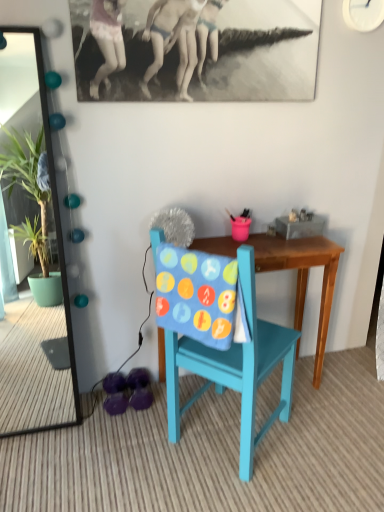
What do you see at coordinates (140, 388) in the screenshot? This screenshot has height=512, width=384. I see `purple fabric footwear at lower left` at bounding box center [140, 388].

In order to face teal painted wood chair at center, should I rotate leftwards or rightwards?

Rotate right and turn 5.147 degrees.

Where is `wooden table at center`? The height and width of the screenshot is (512, 384). wooden table at center is located at coordinates [x=302, y=276].

Locate an element on the screen. green glossy mirror at left is located at coordinates (28, 248).

I want to click on purple fabric footwear at lower left, so click(x=140, y=388).

Is the surface of purple fabric footwear at lower left in direct contact with teal painted wood chair at center?

No, purple fabric footwear at lower left is not with teal painted wood chair at center.

Considering the relative positions of purple fabric footwear at lower left and teal painted wood chair at center in the image provided, is purple fabric footwear at lower left to the left of teal painted wood chair at center from the viewer's perspective?

Yes, purple fabric footwear at lower left is to the left of teal painted wood chair at center.

Which of these two, purple fabric footwear at lower left or teal painted wood chair at center, stands shorter?

purple fabric footwear at lower left.

Does purple fabric footwear at lower left have a lesser width compared to teal painted wood chair at center?

Yes.

Is wooden table at center a part of green glossy mirror at left?

No, wooden table at center is not a part of green glossy mirror at left.

Between green glossy mirror at left and wooden table at center, which one has larger size?

With larger size is wooden table at center.

Considering the relative positions of green glossy mirror at left and wooden table at center in the image provided, is green glossy mirror at left to the left or to the right of wooden table at center?

green glossy mirror at left is positioned on wooden table at center's left side.

From a real-world perspective, between wooden table at center and teal painted wood chair at center, who is vertically lower?

wooden table at center.

Is wooden table at center next to teal painted wood chair at center?

wooden table at center and teal painted wood chair at center are clearly separated.

Based on the photo, does wooden table at center have a lesser width compared to teal painted wood chair at center?

Indeed, wooden table at center has a lesser width compared to teal painted wood chair at center.

Is wooden table at center not inside teal painted wood chair at center?

wooden table at center lies outside teal painted wood chair at center's area.

Is wooden table at center to the left or to the right of green glossy mirror at left in the image?

From the image, it's evident that wooden table at center is to the right of green glossy mirror at left.

Looking at this image, can you tell me how much wooden table at center and green glossy mirror at left differ in facing direction?

They differ by 0.658 degrees in their facing directions.

Is wooden table at center not close to green glossy mirror at left?

wooden table at center is positioned a significant distance from green glossy mirror at left.

Can you confirm if wooden table at center is smaller than green glossy mirror at left?

No, wooden table at center is not smaller than green glossy mirror at left.

Does purple fabric footwear at lower left have a lesser width compared to wooden table at center?

Yes.

From the image's perspective, is purple fabric footwear at lower left above or below wooden table at center?

From the image's perspective, purple fabric footwear at lower left appears below wooden table at center.

Which of these two, purple fabric footwear at lower left or wooden table at center, stands taller?

wooden table at center.

Can you tell me how much purple fabric footwear at lower left and wooden table at center differ in facing direction?

4.01 degrees.

Is green glossy mirror at left inside the boundaries of teal painted wood chair at center, or outside?

green glossy mirror at left is not inside teal painted wood chair at center, it's outside.

Considering the sizes of objects green glossy mirror at left and teal painted wood chair at center in the image provided, who is taller, green glossy mirror at left or teal painted wood chair at center?

green glossy mirror at left.

Looking at this image, considering the relative positions of green glossy mirror at left and teal painted wood chair at center in the image provided, is green glossy mirror at left to the left or to the right of teal painted wood chair at center?

From the image, it's evident that green glossy mirror at left is to the left of teal painted wood chair at center.

How different are the orientations of green glossy mirror at left and teal painted wood chair at center in degrees?

The angular difference between green glossy mirror at left and teal painted wood chair at center is 129 degrees.

Which object is positioned more to the right, teal painted wood chair at center or wooden table at center?

From the viewer's perspective, wooden table at center appears more on the right side.

Is wooden table at center at the back of teal painted wood chair at center?

teal painted wood chair at center is not turned away from wooden table at center.

Does point (243, 477) appear closer or farther from the camera than point (234, 255)?

Point (243, 477) appears to be closer to the viewer than point (234, 255).

Is teal painted wood chair at center far away from wooden table at center?

Actually, teal painted wood chair at center and wooden table at center are a little close together.

You are a GUI agent. You are given a task and a screenshot of the screen. Output one action in this format:
    pyautogui.click(x=<x>, y=<y>)
    Task: Click on the chair that appears above the purple fabric footwear at lower left (from the image's perspective)
    The width and height of the screenshot is (384, 512).
    Given the screenshot: What is the action you would take?
    pyautogui.click(x=235, y=368)

This screenshot has height=512, width=384. In order to click on table behind the green glossy mirror at left in this screenshot , I will do `click(302, 276)`.

Considering their positions, is wooden table at center positioned further to purple fabric footwear at lower left than teal painted wood chair at center?

Based on the image, wooden table at center appears to be further to purple fabric footwear at lower left.

Based on their spatial positions, is green glossy mirror at left or wooden table at center further from purple fabric footwear at lower left?

Based on the image, green glossy mirror at left appears to be further to purple fabric footwear at lower left.

Considering their positions, is wooden table at center positioned further to purple fabric footwear at lower left than green glossy mirror at left?

The object further to purple fabric footwear at lower left is green glossy mirror at left.

Estimate the real-world distances between objects in this image. Which object is further from teal painted wood chair at center, wooden table at center or purple fabric footwear at lower left?

purple fabric footwear at lower left.

Which object lies further to the anchor point purple fabric footwear at lower left, teal painted wood chair at center or green glossy mirror at left?

green glossy mirror at left lies further to purple fabric footwear at lower left than the other object.

Based on their spatial positions, is purple fabric footwear at lower left or green glossy mirror at left closer to wooden table at center?

purple fabric footwear at lower left.

Considering their positions, is wooden table at center positioned further to green glossy mirror at left than purple fabric footwear at lower left?

The object further to green glossy mirror at left is wooden table at center.

Which object lies further to the anchor point wooden table at center, purple fabric footwear at lower left or teal painted wood chair at center?

Based on the image, purple fabric footwear at lower left appears to be further to wooden table at center.

Locate an element on the screen. table located between teal painted wood chair at center and purple fabric footwear at lower left in the depth direction is located at coordinates (302, 276).

Identify the location of chair between green glossy mirror at left and wooden table at center in the horizontal direction. The height and width of the screenshot is (512, 384). (235, 368).

Locate an element on the screen. The height and width of the screenshot is (512, 384). table that lies between green glossy mirror at left and purple fabric footwear at lower left from top to bottom is located at coordinates (302, 276).

I want to click on chair between green glossy mirror at left and purple fabric footwear at lower left vertically, so click(x=235, y=368).